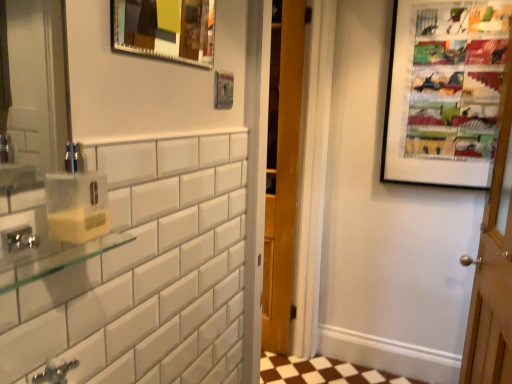
Question: Are yellow translucent soap dispenser at left and matte black picture frame at upper right, which appears as the 1th picture frame when viewed from the right, far apart?

Choices:
 (A) yes
 (B) no

Answer: (A)

Question: Does yellow translucent soap dispenser at left lie behind matte black picture frame at upper right, which appears as the 1th picture frame when viewed from the right?

Choices:
 (A) no
 (B) yes

Answer: (A)

Question: Can you confirm if yellow translucent soap dispenser at left is positioned to the left of matte black picture frame at upper right, which is the third picture frame in front-to-back order?

Choices:
 (A) yes
 (B) no

Answer: (A)

Question: Does yellow translucent soap dispenser at left lie in front of matte black picture frame at upper right, which is the third picture frame in front-to-back order?

Choices:
 (A) no
 (B) yes

Answer: (B)

Question: From a real-world perspective, is yellow translucent soap dispenser at left on matte black picture frame at upper right, which appears as the 1th picture frame when viewed from the right?

Choices:
 (A) no
 (B) yes

Answer: (A)

Question: Are yellow translucent soap dispenser at left and matte black picture frame at upper right, which is the third picture frame in front-to-back order, making contact?

Choices:
 (A) yes
 (B) no

Answer: (B)

Question: Is metallic silver picture frame at upper center, acting as the 2th picture frame starting from the right, thinner than matte black picture frame at upper right, the third picture frame in the left-to-right sequence?

Choices:
 (A) yes
 (B) no

Answer: (A)

Question: Can you confirm if metallic silver picture frame at upper center, acting as the 2th picture frame starting from the right, is wider than matte black picture frame at upper right, the third picture frame in the left-to-right sequence?

Choices:
 (A) yes
 (B) no

Answer: (B)

Question: Is matte black picture frame at upper right, which appears as the 1th picture frame when viewed from the right, at the back of metallic silver picture frame at upper center, the 2th picture frame in the left-to-right sequence?

Choices:
 (A) yes
 (B) no

Answer: (B)

Question: Does metallic silver picture frame at upper center, acting as the 2th picture frame starting from the right, come in front of matte black picture frame at upper right, which is the third picture frame in front-to-back order?

Choices:
 (A) no
 (B) yes

Answer: (B)

Question: Can you confirm if metallic silver picture frame at upper center, acting as the 2th picture frame starting from the right, is taller than matte black picture frame at upper right, the 1th picture frame viewed from the back?

Choices:
 (A) no
 (B) yes

Answer: (A)

Question: Considering the relative sizes of metallic silver picture frame at upper center, the 2th picture frame in the left-to-right sequence, and matte black picture frame at upper right, the 1th picture frame viewed from the back, in the image provided, is metallic silver picture frame at upper center, the 2th picture frame in the left-to-right sequence, smaller than matte black picture frame at upper right, the 1th picture frame viewed from the back,?

Choices:
 (A) no
 (B) yes

Answer: (B)

Question: Is yellow translucent soap dispenser at left positioned before metallic silver picture frame at upper center, acting as the first picture frame starting from the left?

Choices:
 (A) no
 (B) yes

Answer: (B)